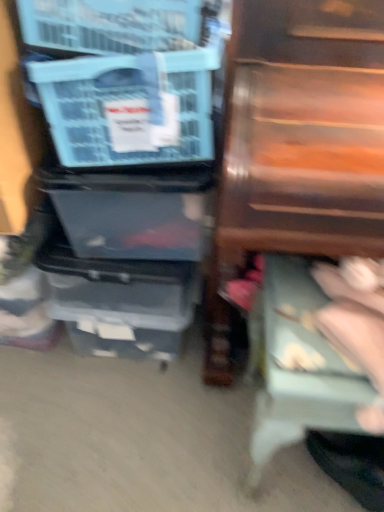
Question: Do you think light blue fabric step stool at lower right is within blue plastic storage box at left, or outside of it?

Choices:
 (A) outside
 (B) inside

Answer: (A)

Question: In terms of width, does light blue fabric step stool at lower right look wider or thinner when compared to blue plastic storage box at left?

Choices:
 (A) wide
 (B) thin

Answer: (A)

Question: Considering the real-world distances, which object is farthest from the wooden drawer at right?

Choices:
 (A) blue plastic storage box at left
 (B) light blue fabric step stool at lower right

Answer: (B)

Question: Considering the real-world distances, which object is closest to the blue plastic storage box at left?

Choices:
 (A) wooden drawer at right
 (B) light blue fabric step stool at lower right

Answer: (A)